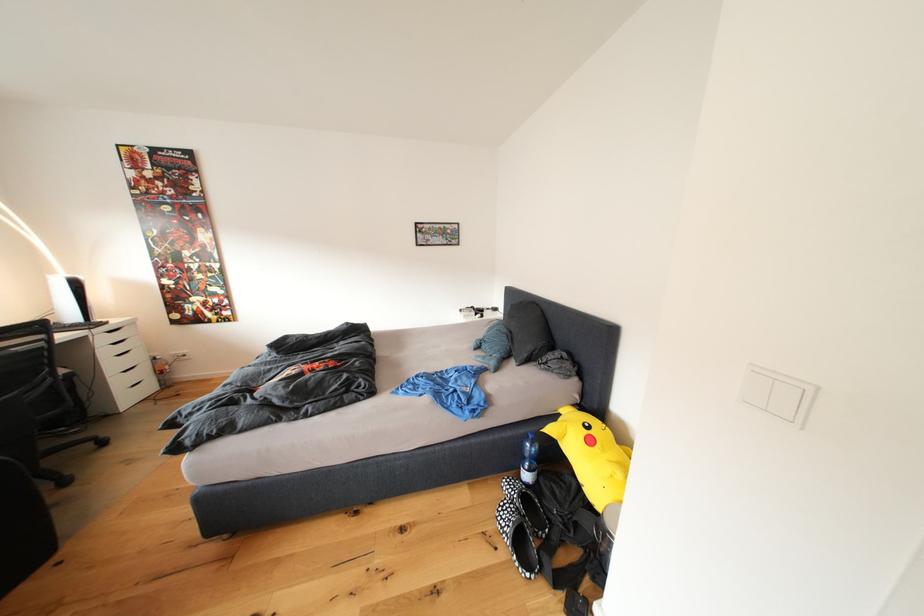
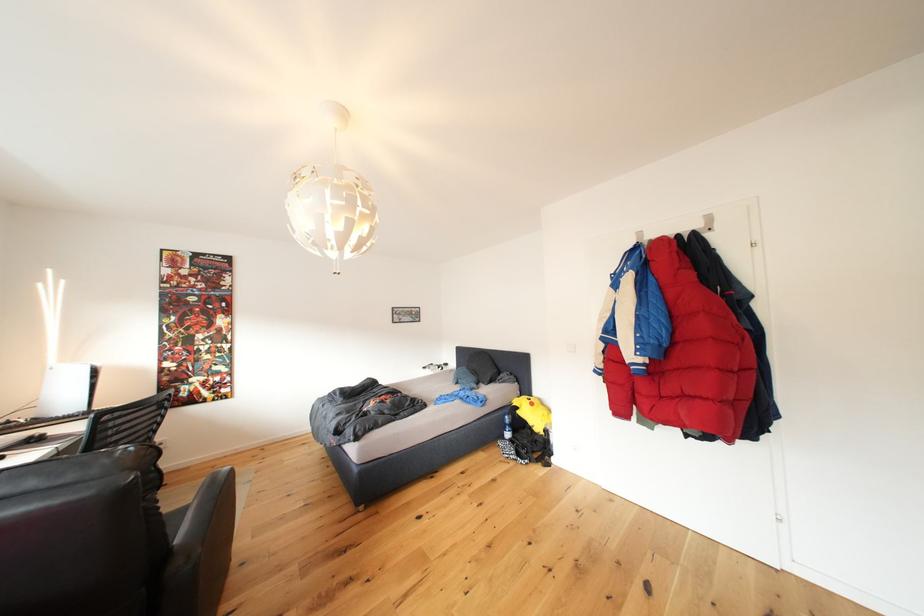
Question: I am providing you with two images of the same scene from different viewpoints. Which of the following objects are not visible in image2?

Choices:
 (A) wooden toilet lid
 (B) white drawer handle
 (C) plastic water bottle
 (D) black chair armrest

Answer: (B)